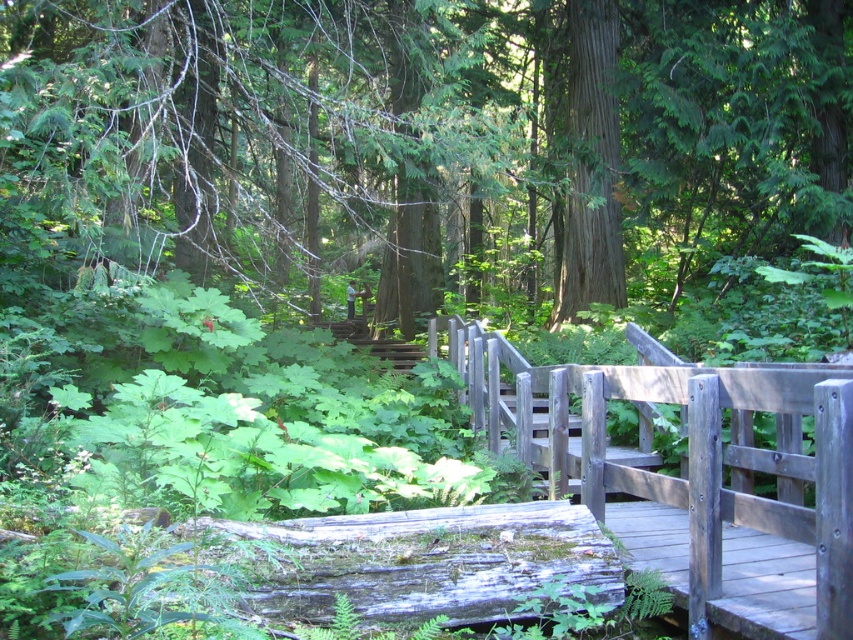
You are a hiker trying to cross the wooden bridge at center. You notice a smooth green tree at center nearby. Which object is wider in this scene?

The smooth green tree at center is wider than the wooden bridge at center.

You are a hiker standing on the wooden bridge and looking towards the forest. You see the smooth green tree at center and the smooth brown tree trunk at upper center. Which tree is closer to you?

The smooth green tree at center is closer to you since it is in front of the smooth brown tree trunk at upper center.

You are a hiker who wants to cross the wooden bridge at center. However, you notice a smooth brown tree trunk at upper center nearby. Which object is taller when viewed from below?

The smooth brown tree trunk at upper center is taller than the wooden bridge at center.